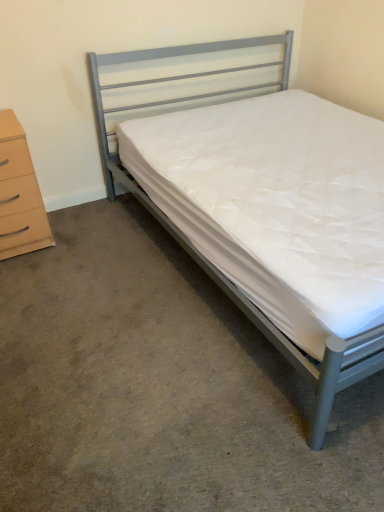
Question: Based on their positions, is metallic gray bed at center located to the left or right of white quilted mattress at center?

Choices:
 (A) left
 (B) right

Answer: (B)

Question: From a real-world perspective, is metallic gray bed at center physically located above or below white quilted mattress at center?

Choices:
 (A) below
 (B) above

Answer: (B)

Question: Which object is positioned farthest from the beige wood chest of drawers at left?

Choices:
 (A) white quilted mattress at center
 (B) metallic gray bed at center

Answer: (A)

Question: Based on their relative distances, which object is nearer to the white quilted mattress at center?

Choices:
 (A) metallic gray bed at center
 (B) beige wood chest of drawers at left

Answer: (B)